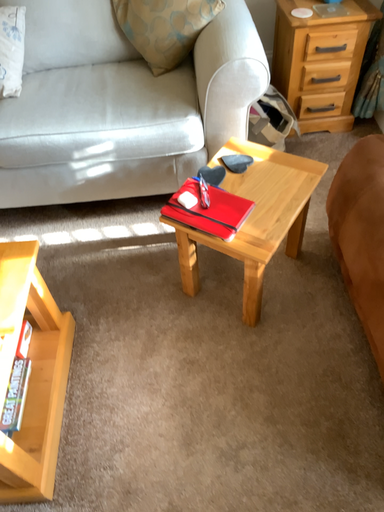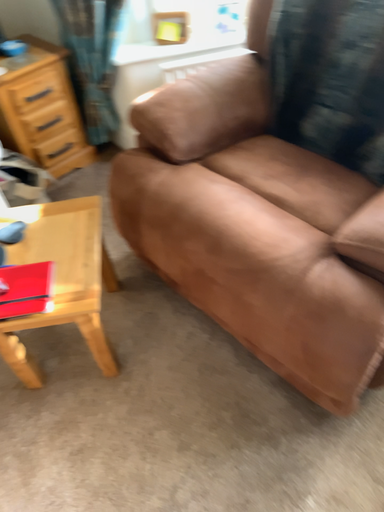
Question: How did the camera likely rotate when shooting the video?

Choices:
 (A) rotated downward
 (B) rotated upward

Answer: (B)